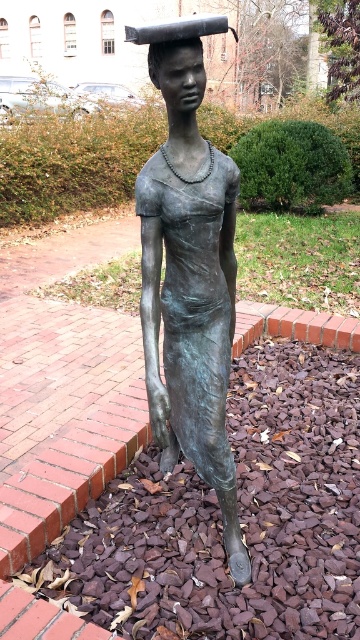
Which is behind, point (159, 230) or point (181, 51)?

Positioned behind is point (159, 230).

Is bronze statue at center further to the viewer compared to bronze statue head at upper center?

That is False.

Where is `bronze statue at center`? The width and height of the screenshot is (360, 640). bronze statue at center is located at coordinates (190, 273).

Locate an element on the screen. Image resolution: width=360 pixels, height=640 pixels. bronze statue at center is located at coordinates (190, 273).